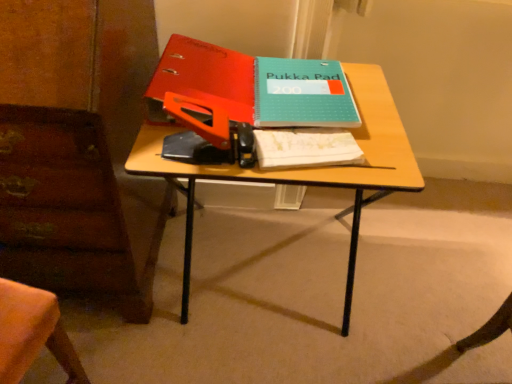
Find the location of a particular element. spots to the right of white paper notebook at center is located at coordinates 381,165.